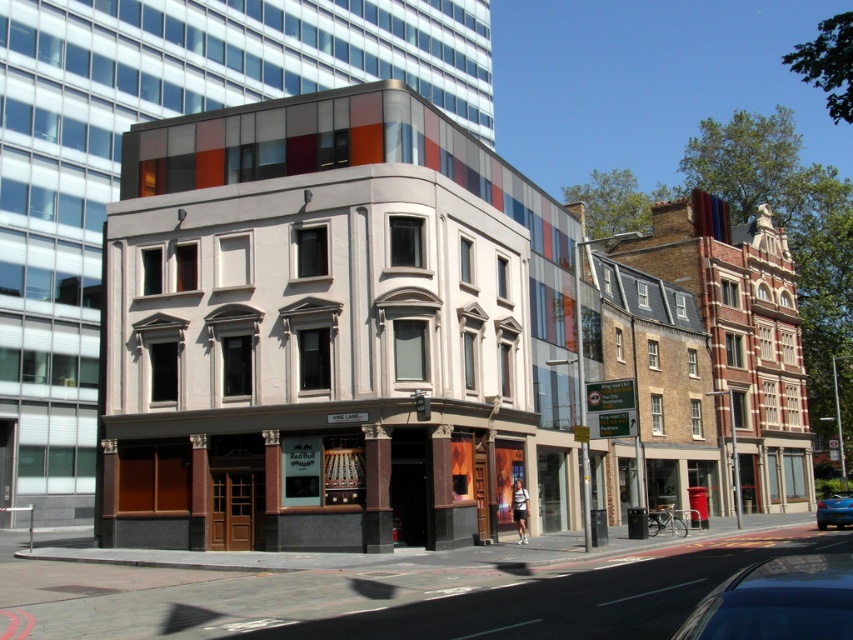
You are standing at the point labeled as point (805, 627) in the image. A friend is located at your current position and wants to throw a ball to you. If they can throw the ball up to 2.5 meters, will they be able to reach you?

The distance between point (805, 627) and the viewer is 2.45 meters. Since the friend can throw the ball up to 2.5 meters, they will be able to reach you.

You are a delivery driver who needs to park your metallic blue car at center in a parking spot that can only accommodate vehicles up to the size of the blue glossy sedan at lower right. Can your car fit in the spot?

The metallic blue car at center is smaller than the blue glossy sedan at lower right, so it can fit in the parking spot designed for the sedan.

You are a pedestrian standing on the sidewalk in front of the modern building. You see the metallic blue car at center and the blue glossy sedan at lower right. Which vehicle is closer to you?

The metallic blue car at center is closer to the viewer than the blue glossy sedan at lower right.